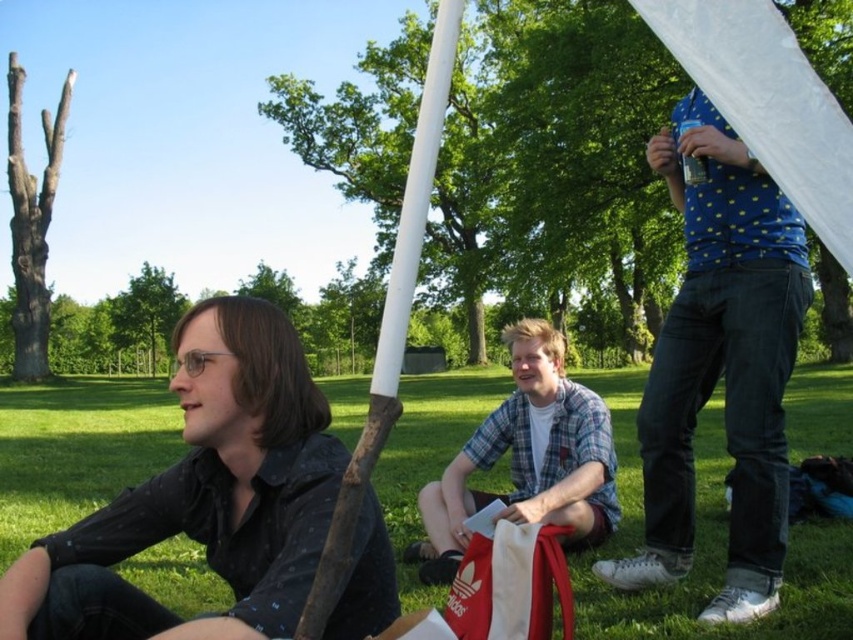
Question: Which object is positioned closest to the green grass at lower center?

Choices:
 (A) plaid fabric shirt at center
 (B) black dotted shirt at left

Answer: (B)

Question: Is green grass at lower center to the left of black dotted shirt at left from the viewer's perspective?

Choices:
 (A) yes
 (B) no

Answer: (A)

Question: Observing the image, what is the correct spatial positioning of blue dotted shirt at upper right in reference to white smooth pole at center?

Choices:
 (A) above
 (B) below

Answer: (A)

Question: Which of the following is the closest to the observer?

Choices:
 (A) (257, 570)
 (B) (567, 410)

Answer: (A)

Question: Is green grass at lower center positioned behind black dotted shirt at left?

Choices:
 (A) yes
 (B) no

Answer: (A)

Question: Which point is closer to the camera?

Choices:
 (A) green grass at lower center
 (B) black dotted shirt at left
 (C) plaid fabric shirt at center
 (D) white smooth pole at center

Answer: (D)